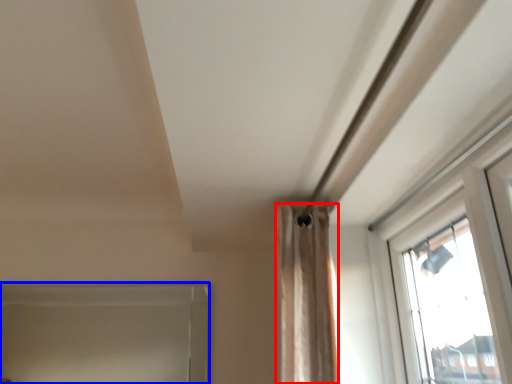
Question: Which point is further to the camera, curtain (highlighted by a red box) or window frame (highlighted by a blue box)?

Choices:
 (A) curtain
 (B) window frame

Answer: (B)